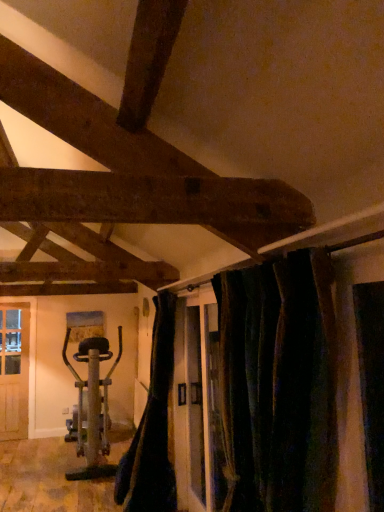
Question: From a real-world perspective, is metallic silver exercise bike at left positioned over black fabric curtain at lower center, the second curtain when ordered from front to back, based on gravity?

Choices:
 (A) yes
 (B) no

Answer: (B)

Question: From the image's perspective, is metallic silver exercise bike at left over black fabric curtain at lower center, the second curtain when ordered from front to back?

Choices:
 (A) yes
 (B) no

Answer: (B)

Question: Is metallic silver exercise bike at left far away from black fabric curtain at lower center, the 1th curtain when ordered from back to front?

Choices:
 (A) no
 (B) yes

Answer: (B)

Question: Is metallic silver exercise bike at left smaller than black fabric curtain at lower center, placed as the first curtain when sorted from left to right?

Choices:
 (A) yes
 (B) no

Answer: (B)

Question: Are metallic silver exercise bike at left and black fabric curtain at lower center, placed as the first curtain when sorted from left to right, beside each other?

Choices:
 (A) yes
 (B) no

Answer: (B)

Question: Considering the relative sizes of metallic silver exercise bike at left and black fabric curtain at lower center, the 1th curtain when ordered from back to front, in the image provided, is metallic silver exercise bike at left thinner than black fabric curtain at lower center, the 1th curtain when ordered from back to front,?

Choices:
 (A) yes
 (B) no

Answer: (B)

Question: From a real-world perspective, is metallic silver exercise bike at left located higher than dark velvet curtains at center, the 1th curtain in the right-to-left sequence?

Choices:
 (A) yes
 (B) no

Answer: (B)

Question: Is the depth of metallic silver exercise bike at left greater than that of dark velvet curtains at center, the 1th curtain in the right-to-left sequence?

Choices:
 (A) yes
 (B) no

Answer: (A)

Question: Is metallic silver exercise bike at left to the right of dark velvet curtains at center, the 1th curtain in the right-to-left sequence, from the viewer's perspective?

Choices:
 (A) yes
 (B) no

Answer: (B)

Question: Does metallic silver exercise bike at left have a lesser width compared to dark velvet curtains at center, which ranks as the 2th curtain in left-to-right order?

Choices:
 (A) no
 (B) yes

Answer: (A)

Question: From the image's perspective, would you say metallic silver exercise bike at left is positioned over dark velvet curtains at center, arranged as the second curtain when viewed from the back?

Choices:
 (A) yes
 (B) no

Answer: (B)

Question: Can we say metallic silver exercise bike at left lies outside dark velvet curtains at center, arranged as the second curtain when viewed from the back?

Choices:
 (A) no
 (B) yes

Answer: (B)

Question: From a real-world perspective, is black fabric curtain at lower center, which appears as the second curtain when viewed from the right, under metallic silver exercise bike at left?

Choices:
 (A) no
 (B) yes

Answer: (A)